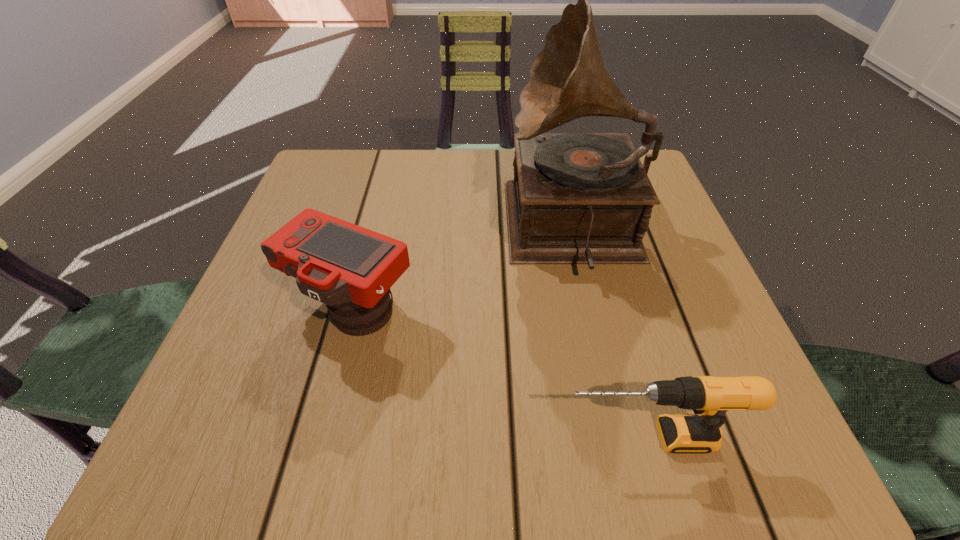
Locate an element on the screen. Image resolution: width=960 pixels, height=540 pixels. free spot between the drill and the camera is located at coordinates (500, 373).

Find the location of `unoccupied area between the record player and the nearest object`. unoccupied area between the record player and the nearest object is located at coordinates (611, 333).

This screenshot has width=960, height=540. Identify the location of free space that is in between the leftmost object and the drill. pyautogui.click(x=500, y=373).

This screenshot has width=960, height=540. Identify the location of the closest object to the drill. (350, 269).

Image resolution: width=960 pixels, height=540 pixels. I want to click on the second closest object to the record player, so click(x=711, y=397).

Find the location of a particular element. The height and width of the screenshot is (540, 960). free region that satisfies the following two spatial constraints: 1. from the horn of the record player; 2. on the front side of the leftmost object is located at coordinates (592, 308).